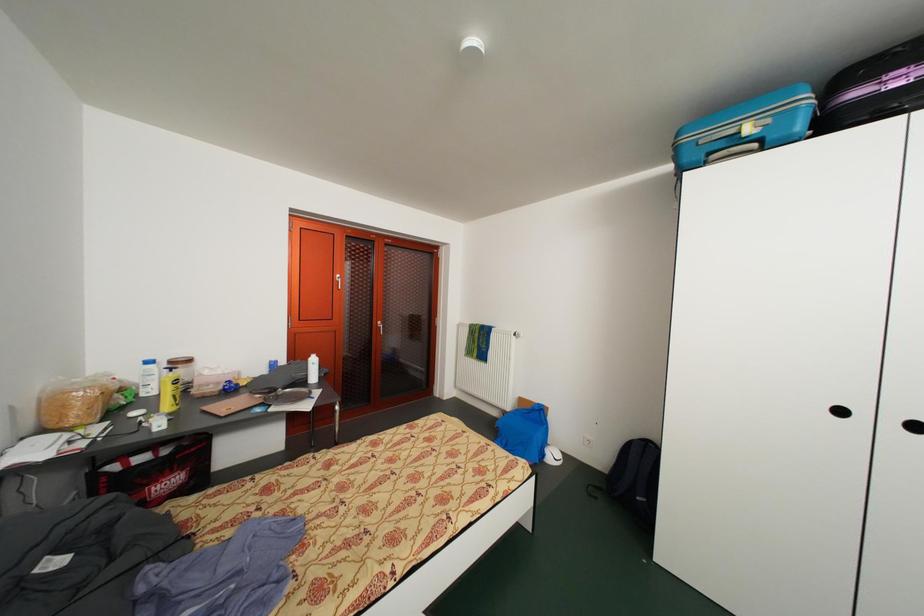
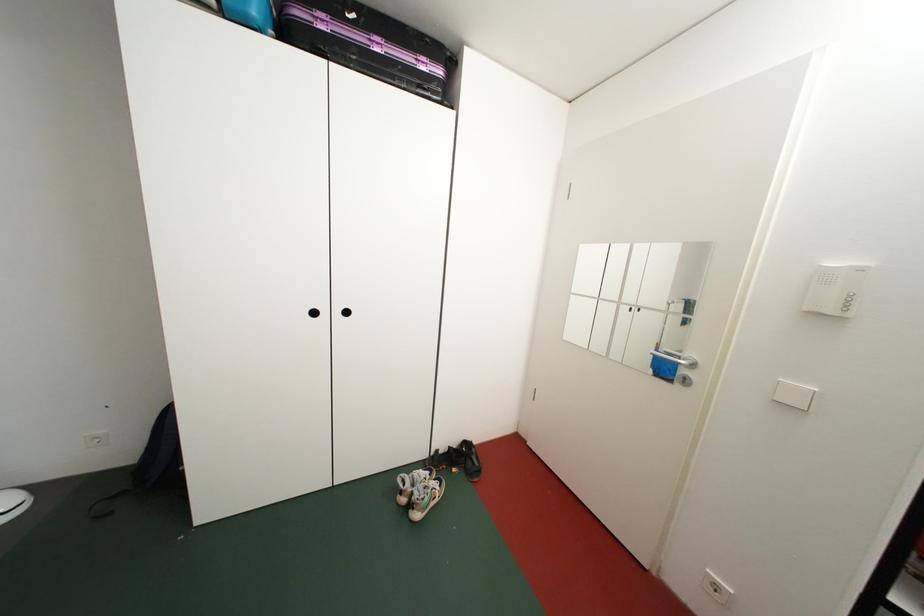
Question: The camera is either moving clockwise (left) or counter-clockwise (right) around the object. The first image is from the beginning of the video and the second image is from the end. Is the camera moving left or right when shooting the video?

Choices:
 (A) Left
 (B) Right

Answer: (A)